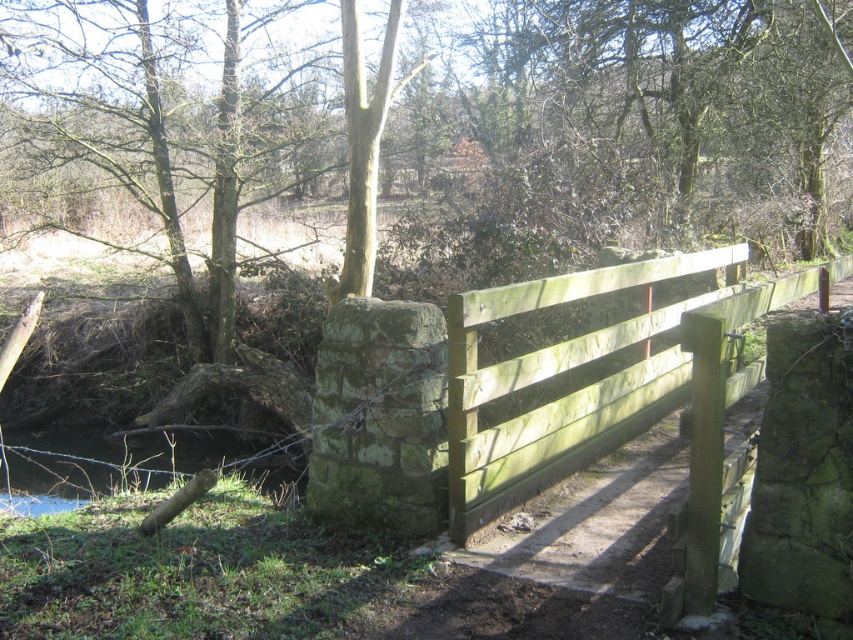
Question: Does green painted wood fence at center lie in front of green grassy river at lower left?

Choices:
 (A) yes
 (B) no

Answer: (A)

Question: Which of the following is the closest to the observer?

Choices:
 (A) green grassy river at lower left
 (B) green painted wood fence at center

Answer: (B)

Question: Is green painted wood fence at center closer to camera compared to green grassy river at lower left?

Choices:
 (A) no
 (B) yes

Answer: (B)

Question: Which point is closer to the camera?

Choices:
 (A) (206, 442)
 (B) (523, 376)

Answer: (B)

Question: From the image, what is the correct spatial relationship of green painted wood fence at center in relation to green grassy river at lower left?

Choices:
 (A) left
 (B) right

Answer: (B)